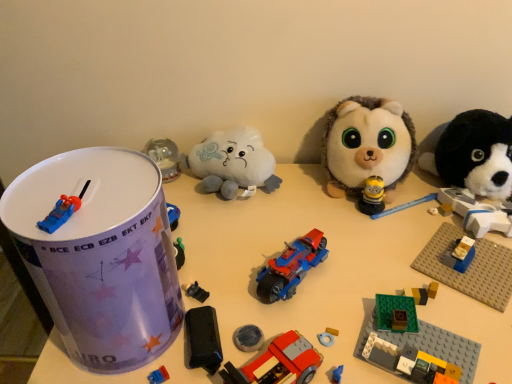
Identify the location of free location to the left of black plush dog at right, positioned as the 1th toy in right-to-left order. (404, 225).